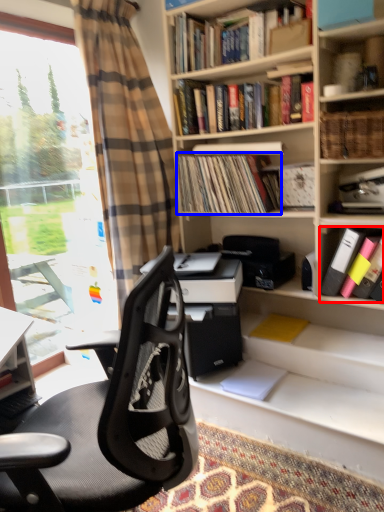
Question: Which of the following is the farthest to the observer, book (highlighted by a red box) or book (highlighted by a blue box)?

Choices:
 (A) book
 (B) book

Answer: (B)